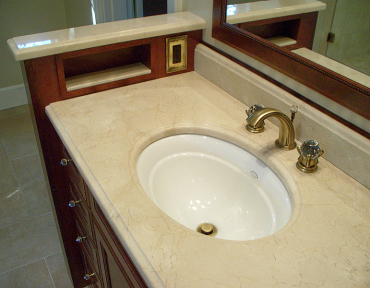
Locate an element on the screen. Image resolution: width=370 pixels, height=288 pixels. faucet is located at coordinates (264, 115).